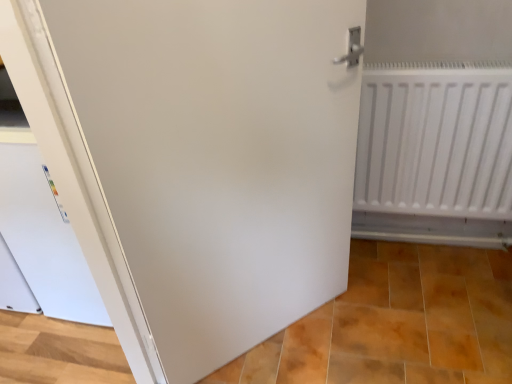
The image size is (512, 384). In order to click on matte white tile at lower center in this screenshot , I will do `click(397, 323)`.

Where is `matte white tile at lower center`? matte white tile at lower center is located at coordinates (397, 323).

Based on the photo, from a real-world perspective, is white matte radiator at right below white matte door at center?

Yes, from a real-world perspective, white matte radiator at right is beneath white matte door at center.

Looking at the image, does white matte radiator at right seem bigger or smaller compared to white matte door at center?

Clearly, white matte radiator at right is smaller in size than white matte door at center.

From the image's perspective, which one is positioned lower, white matte radiator at right or white matte door at center?

white matte door at center, from the image's perspective.

This screenshot has height=384, width=512. Find the location of `radiator on the right of white matte door at center`. radiator on the right of white matte door at center is located at coordinates (436, 139).

Considering the sizes of matte white tile at lower center and white matte radiator at right in the image, is matte white tile at lower center wider or thinner than white matte radiator at right?

Considering their sizes, matte white tile at lower center looks broader than white matte radiator at right.

Do you think matte white tile at lower center is within white matte radiator at right, or outside of it?

matte white tile at lower center is not inside white matte radiator at right, it's outside.

Is matte white tile at lower center turned away from white matte radiator at right?

No, matte white tile at lower center is not facing the opposite direction of white matte radiator at right.

This screenshot has height=384, width=512. I want to click on tile located underneath the white matte door at center (from a real-world perspective), so click(x=397, y=323).

Would you say matte white tile at lower center is part of white matte door at center's contents?

No, matte white tile at lower center is not inside white matte door at center.

Is white matte door at center positioned with its back to matte white tile at lower center?

No, matte white tile at lower center is not at the back of white matte door at center.

Between matte white tile at lower center and white matte door at center, which one is positioned behind?

Positioned behind is matte white tile at lower center.

In terms of height, does matte white tile at lower center look taller or shorter compared to white matte door at center?

matte white tile at lower center is shorter than white matte door at center.

Is matte white tile at lower center positioned with its back to white matte door at center?

That's not correct — matte white tile at lower center is not looking away from white matte door at center.

Can you confirm if matte white tile at lower center is wider than white matte door at center?

Indeed, matte white tile at lower center has a greater width compared to white matte door at center.

Is point (441, 62) farther from camera compared to point (294, 323)?

No, it is in front of (294, 323).

Considering the sizes of objects white matte radiator at right and matte white tile at lower center in the image provided, who is shorter, white matte radiator at right or matte white tile at lower center?

matte white tile at lower center.

In terms of width, does white matte radiator at right look wider or thinner when compared to matte white tile at lower center?

Considering their sizes, white matte radiator at right looks slimmer than matte white tile at lower center.

From the image's perspective, is white matte radiator at right located above or below matte white tile at lower center?

Clearly, from the image's perspective, white matte radiator at right is above matte white tile at lower center.

Could you tell me if white matte door at center is turned towards white matte radiator at right?

No, white matte door at center is not facing towards white matte radiator at right.

Is white matte door at center at the left side of white matte radiator at right?

Correct, you'll find white matte door at center to the left of white matte radiator at right.

In order to click on door lying in front of the white matte radiator at right in this screenshot , I will do pyautogui.click(x=219, y=158).

From a real-world perspective, is white matte door at center positioned under white matte radiator at right based on gravity?

No, from a real-world perspective, white matte door at center is not under white matte radiator at right.

I want to click on door lying in front of the white matte radiator at right, so click(x=219, y=158).

This screenshot has height=384, width=512. In order to click on radiator lying on the right of matte white tile at lower center in this screenshot , I will do `click(436, 139)`.

From the picture: Based on their spatial positions, is matte white tile at lower center or white matte radiator at right further from white matte door at center?

The object further to white matte door at center is matte white tile at lower center.

Looking at the image, which one is located closer to white matte radiator at right, matte white tile at lower center or white matte door at center?

Based on the image, white matte door at center appears to be nearer to white matte radiator at right.

Estimate the real-world distances between objects in this image. Which object is further from matte white tile at lower center, white matte radiator at right or white matte door at center?

The object further to matte white tile at lower center is white matte radiator at right.

Which object lies further to the anchor point matte white tile at lower center, white matte door at center or white matte radiator at right?

white matte radiator at right.

From the image, which object appears to be nearer to white matte radiator at right, white matte door at center or matte white tile at lower center?

Based on the image, white matte door at center appears to be nearer to white matte radiator at right.

From the image, which object appears to be farther from white matte door at center, white matte radiator at right or matte white tile at lower center?

matte white tile at lower center is positioned further to the anchor white matte door at center.

The image size is (512, 384). I want to click on tile located between white matte door at center and white matte radiator at right in the left-right direction, so click(x=397, y=323).